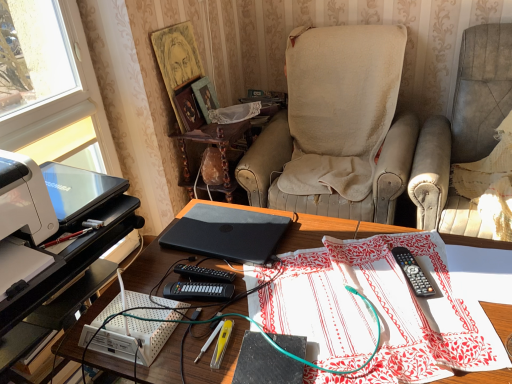
Question: Should I look upward or downward to see orange matte laptop at center, placed as the 2th laptop when sorted from left to right?

Choices:
 (A) down
 (B) up

Answer: (A)

Question: From a real-world perspective, does matte black laptop at center sit lower than black plastic keyboard at center, which appears as the first stationery when viewed from the left?

Choices:
 (A) yes
 (B) no

Answer: (A)

Question: Is the depth of matte black laptop at center greater than that of black plastic keyboard at center, acting as the 2th stationery starting from the right?

Choices:
 (A) yes
 (B) no

Answer: (B)

Question: Is matte black laptop at center far from black plastic keyboard at center, which appears as the first stationery when viewed from the left?

Choices:
 (A) yes
 (B) no

Answer: (B)

Question: Does matte black laptop at center touch black plastic keyboard at center, acting as the 2th stationery starting from the right?

Choices:
 (A) yes
 (B) no

Answer: (B)

Question: From a real-world perspective, is matte black laptop at center on black plastic keyboard at center, which appears as the first stationery when viewed from the left?

Choices:
 (A) yes
 (B) no

Answer: (B)

Question: Is matte black laptop at center thinner than black plastic keyboard at center, which appears as the first stationery when viewed from the left?

Choices:
 (A) no
 (B) yes

Answer: (A)

Question: Is white printed fabric at center located within beige fabric chair at center, the 2th chair viewed from the right?

Choices:
 (A) no
 (B) yes

Answer: (A)

Question: Does beige fabric chair at center, the 2th chair viewed from the right, have a lesser height compared to white printed fabric at center?

Choices:
 (A) yes
 (B) no

Answer: (B)

Question: Would you consider beige fabric chair at center, acting as the first chair starting from the left, to be distant from white printed fabric at center?

Choices:
 (A) no
 (B) yes

Answer: (A)

Question: Considering the relative sizes of beige fabric chair at center, the 2th chair viewed from the right, and white printed fabric at center in the image provided, is beige fabric chair at center, the 2th chair viewed from the right, bigger than white printed fabric at center?

Choices:
 (A) yes
 (B) no

Answer: (A)

Question: Can you confirm if beige fabric chair at center, the 2th chair viewed from the right, is smaller than white printed fabric at center?

Choices:
 (A) no
 (B) yes

Answer: (A)

Question: Considering the relative positions of beige fabric chair at center, the 2th chair viewed from the right, and white printed fabric at center in the image provided, is beige fabric chair at center, the 2th chair viewed from the right, to the right of white printed fabric at center from the viewer's perspective?

Choices:
 (A) yes
 (B) no

Answer: (A)

Question: Is black plastic remote control at center, acting as the 2th stationery starting from the left, turned away from orange matte laptop at center, the first laptop from the right?

Choices:
 (A) no
 (B) yes

Answer: (A)